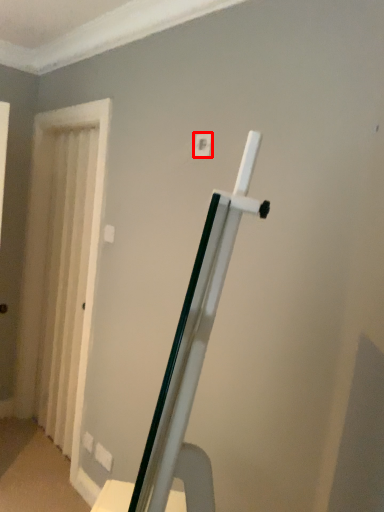
Question: In this image, where is light switch (annotated by the red box) located relative to curtain?

Choices:
 (A) right
 (B) left

Answer: (A)